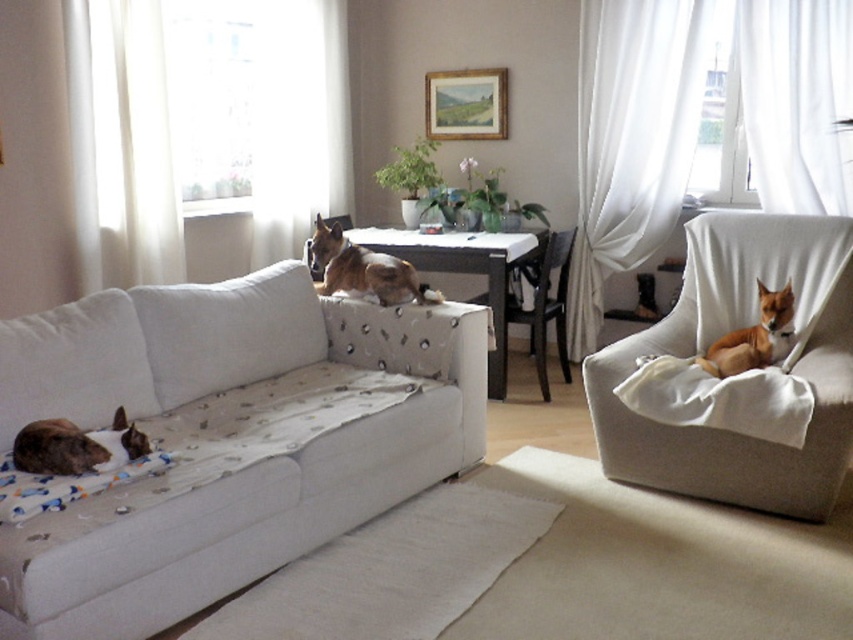
Question: Observing the image, what is the correct spatial positioning of light brown fabric armchair at center in reference to brown furry dog at right?

Choices:
 (A) below
 (B) above

Answer: (B)

Question: Which object is the farthest from the fluffy brown cat at lower left?

Choices:
 (A) white fabric pillow at center
 (B) beige fabric armchair at right
 (C) brown furry dog at right
 (D) light brown fabric armchair at center

Answer: (D)

Question: Is white sheer curtain at upper right thinner than light brown fabric armchair at center?

Choices:
 (A) no
 (B) yes

Answer: (A)

Question: Which of these objects is positioned closest to the beige fabric armchair at right?

Choices:
 (A) white sheer curtain at upper right
 (B) white fabric couch at lower left

Answer: (A)

Question: Is beige fabric armchair at right thinner than fluffy brown cat at lower left?

Choices:
 (A) no
 (B) yes

Answer: (A)

Question: Which object is the farthest from the white sheer curtain at upper right?

Choices:
 (A) fluffy brown cat at lower left
 (B) light brown fabric armchair at center
 (C) white fabric couch at lower left

Answer: (A)